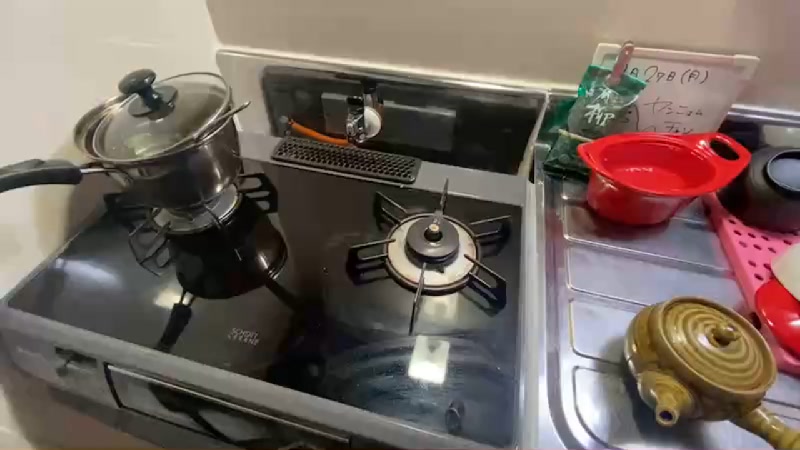
Identify the location of vent on stovetop. Image resolution: width=800 pixels, height=450 pixels. pyautogui.click(x=334, y=162).